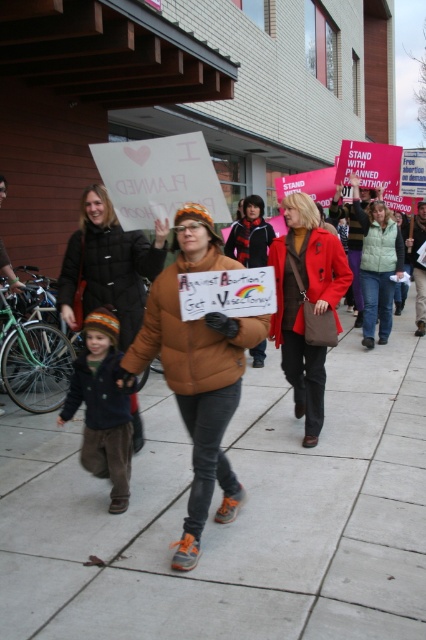
Question: Can you confirm if gray concrete sidewalk at center is positioned above green quilted vest at center?

Choices:
 (A) no
 (B) yes

Answer: (A)

Question: Can you confirm if gray concrete sidewalk at center is positioned above knitted wool hat at center?

Choices:
 (A) no
 (B) yes

Answer: (A)

Question: Which of the following is the closest to the observer?

Choices:
 (A) green quilted vest at center
 (B) gray concrete sidewalk at center
 (C) matte brown coat at center

Answer: (B)

Question: Can you confirm if brown leather jacket at center is bigger than knitted wool hat at center?

Choices:
 (A) no
 (B) yes

Answer: (B)

Question: Which is farther from the brown puffy jacket at center?

Choices:
 (A) green quilted vest at center
 (B) knitted wool hat at center
 (C) gray concrete sidewalk at center
 (D) matte brown coat at center

Answer: (A)

Question: Which point appears closest to the camera in this image?

Choices:
 (A) (319, 348)
 (B) (120, 413)
 (C) (204, 392)

Answer: (C)